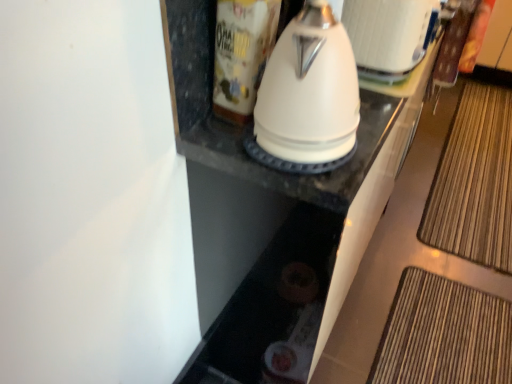
Question: In the image, is white glossy kettle at upper center on the left side or the right side of white glossy canister at upper center?

Choices:
 (A) right
 (B) left

Answer: (A)

Question: From a real-world perspective, relative to white glossy canister at upper center, is white glossy kettle at upper center vertically above or below?

Choices:
 (A) above
 (B) below

Answer: (B)

Question: Based on their relative distances, which object is farther from the bamboo mat at lower right?

Choices:
 (A) white glossy canister at upper center
 (B) white glossy kettle at upper center
 (C) white glossy kettle at center

Answer: (A)

Question: Estimate the real-world distances between objects in this image. Which object is closer to the white glossy kettle at center?

Choices:
 (A) white glossy canister at upper center
 (B) bamboo mat at lower right
 (C) white glossy kettle at upper center

Answer: (A)